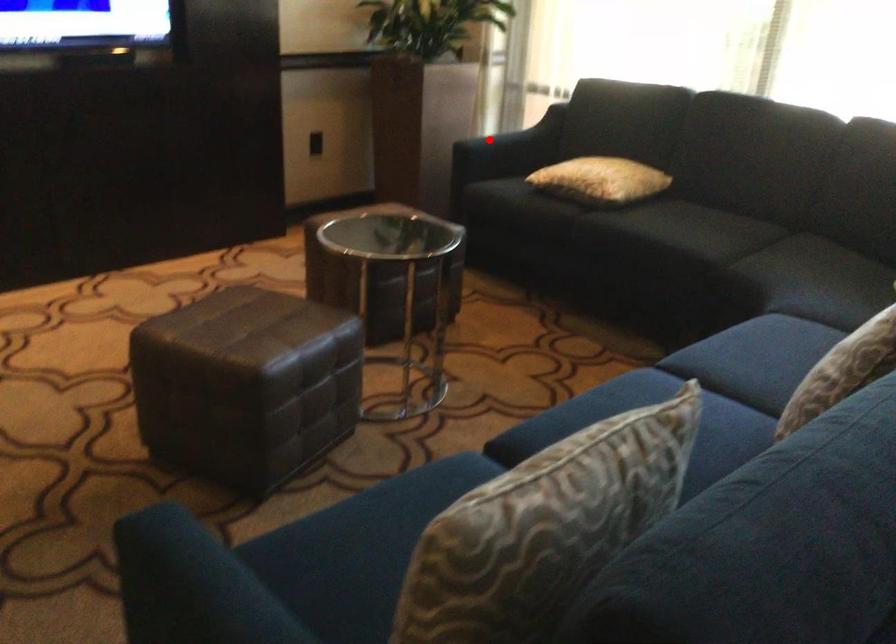
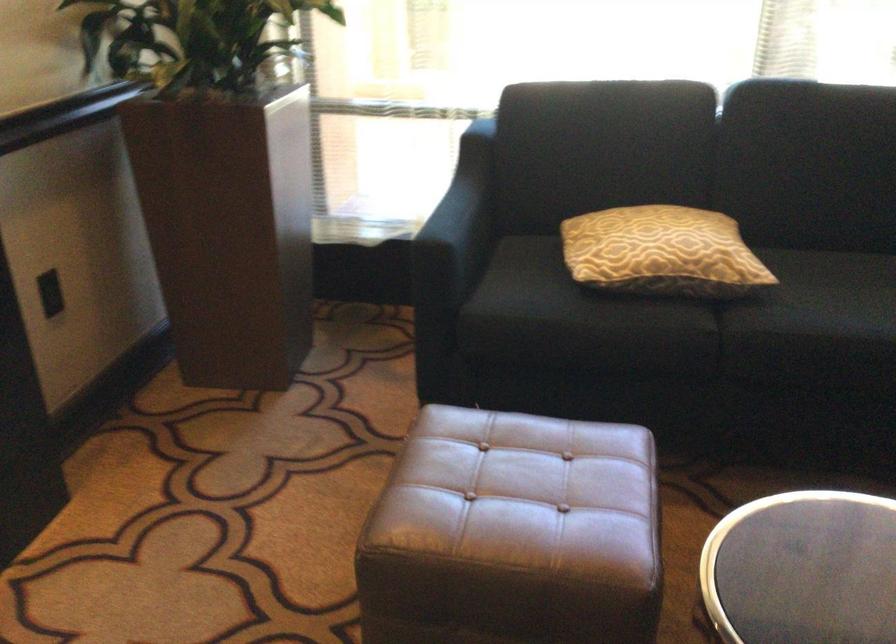
Question: I am providing you with two images of the same scene from different viewpoints. In image1, a red point is highlighted. Considering the same 3D point in image2, which of the following is correct?

Choices:
 (A) It is closer
 (B) It is farther

Answer: (A)